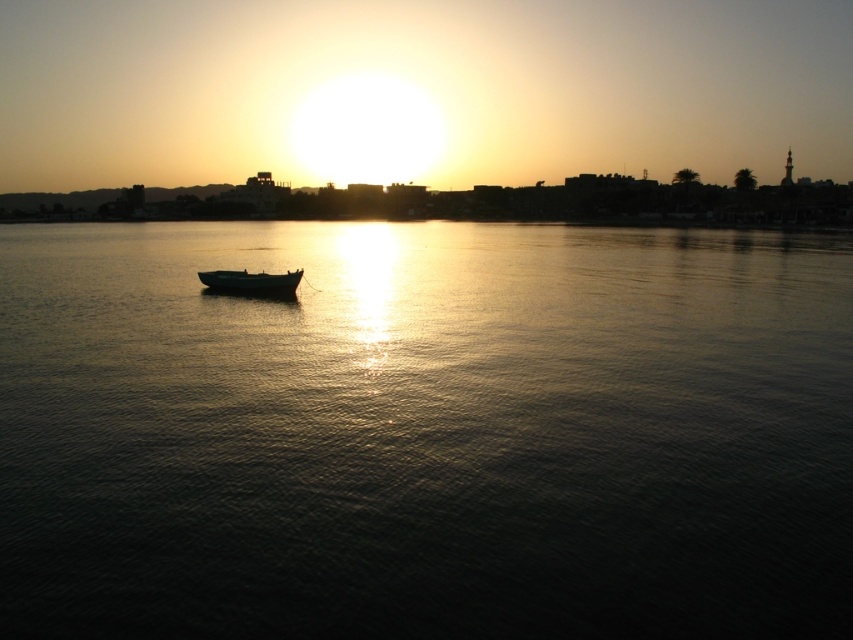
Question: Does dark water at center appear under wooden boat at center?

Choices:
 (A) yes
 (B) no

Answer: (B)

Question: Does dark water at center appear over wooden boat at center?

Choices:
 (A) yes
 (B) no

Answer: (A)

Question: Which object is farther from the camera taking this photo?

Choices:
 (A) dark water at center
 (B) wooden boat at center

Answer: (B)

Question: Which object appears farthest from the camera in this image?

Choices:
 (A) wooden boat at center
 (B) dark water at center

Answer: (A)

Question: Which object is closer to the camera taking this photo?

Choices:
 (A) wooden boat at center
 (B) dark water at center

Answer: (B)

Question: Is dark water at center behind wooden boat at center?

Choices:
 (A) no
 (B) yes

Answer: (A)